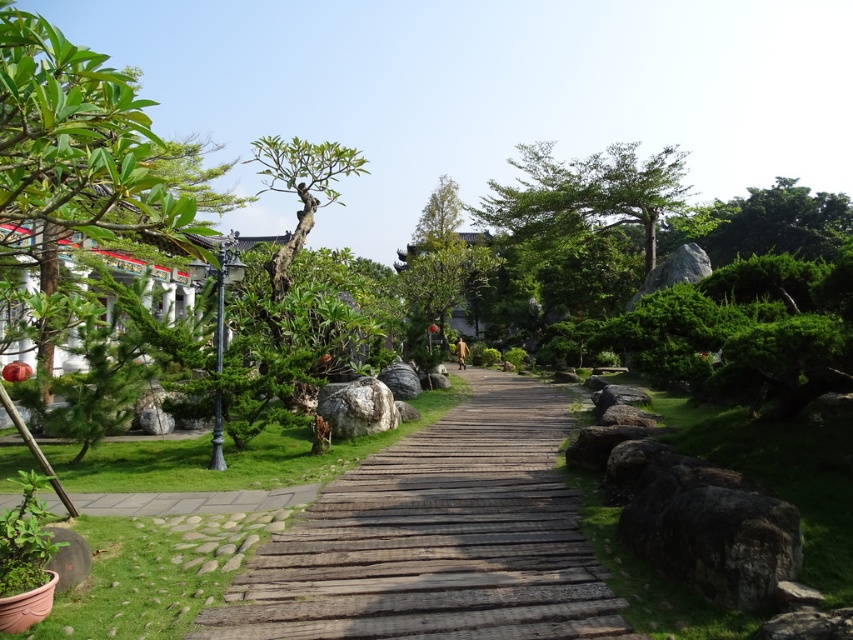
You are planning to place a new garden bench along the pathway in the image. The bench requires a space larger than the green leafy tree at upper center. Can the weathered wood path at center accommodate the bench?

The weathered wood path at center is larger in size than the green leafy tree at upper center, so it can accommodate the bench.

You are a gardener planning to place a new decorative statue that is 1 meter wide on the garden pathway. Considering the available space between the green leafy tree at left and the gray polished stone at center, will there be enough room for the statue?

The green leafy tree at left might be wider than the gray polished stone at center. However, since the exact width difference isn not specified, it is uncertain if the space between them can accommodate a 1 meter wide statue. Further measurement is needed to determine the available space.